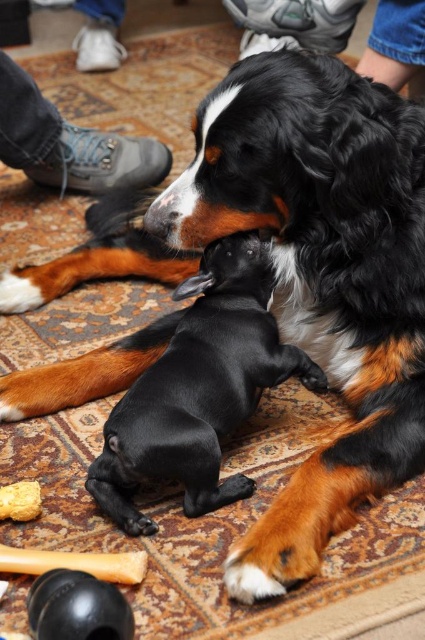
You are a dog owner trying to locate your jeans to put on before stepping outside. You see the jeans at upper center in the image. Based on their position, can you estimate how far they are from the two dogs on the patterned rug?

The jeans at upper center are located at coordinates point (297,20), which places them relatively close to the dogs on the rug. However, without additional reference points or scale information, an exact distance cannot be determined.